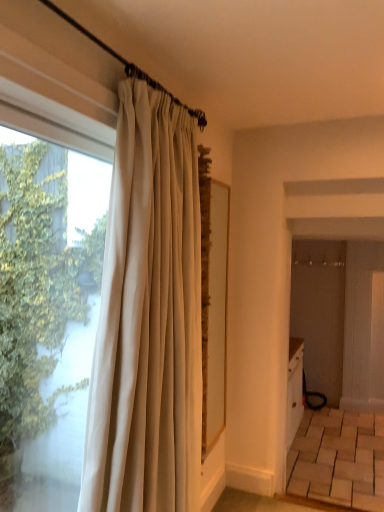
Question: Is transparent glass window at left far away from white silk curtain at left?

Choices:
 (A) yes
 (B) no

Answer: (B)

Question: Is transparent glass window at left oriented towards white silk curtain at left?

Choices:
 (A) yes
 (B) no

Answer: (A)

Question: Is transparent glass window at left bigger than white silk curtain at left?

Choices:
 (A) no
 (B) yes

Answer: (A)

Question: From the image's perspective, does transparent glass window at left appear lower than white silk curtain at left?

Choices:
 (A) no
 (B) yes

Answer: (A)

Question: From a real-world perspective, is transparent glass window at left below white silk curtain at left?

Choices:
 (A) no
 (B) yes

Answer: (A)

Question: From a real-world perspective, is transparent glass window at left physically above white silk curtain at left?

Choices:
 (A) no
 (B) yes

Answer: (B)

Question: Is white silk curtain at left oriented towards transparent glass window at left?

Choices:
 (A) no
 (B) yes

Answer: (A)

Question: Considering the relative positions of white silk curtain at left and transparent glass window at left in the image provided, is white silk curtain at left to the right of transparent glass window at left from the viewer's perspective?

Choices:
 (A) no
 (B) yes

Answer: (B)

Question: Is white silk curtain at left in front of transparent glass window at left?

Choices:
 (A) no
 (B) yes

Answer: (A)

Question: Is white silk curtain at left outside of transparent glass window at left?

Choices:
 (A) no
 (B) yes

Answer: (B)

Question: Is transparent glass window at left at the back of white silk curtain at left?

Choices:
 (A) no
 (B) yes

Answer: (B)

Question: Can you confirm if white silk curtain at left is thinner than transparent glass window at left?

Choices:
 (A) no
 (B) yes

Answer: (A)

Question: In terms of width, does white silk curtain at left look wider or thinner when compared to transparent glass window at left?

Choices:
 (A) wide
 (B) thin

Answer: (A)